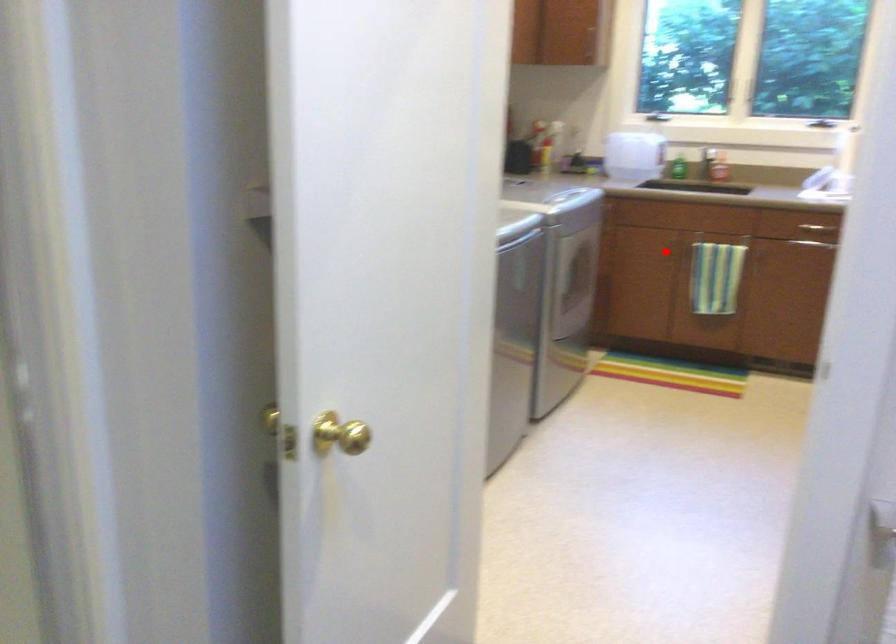
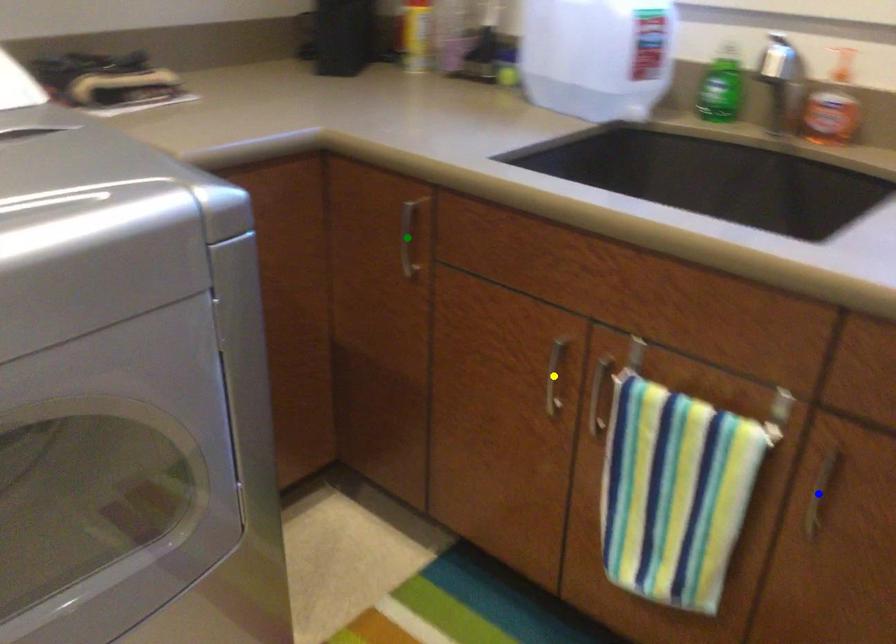
Question: I am providing you with two images of the same scene from different viewpoints. A red point is marked on the first image. You are given multiple points on the second image. In image 2, which mark is for the same physical point as the one in image 1?

Choices:
 (A) yellow point
 (B) green point
 (C) blue point

Answer: (A)